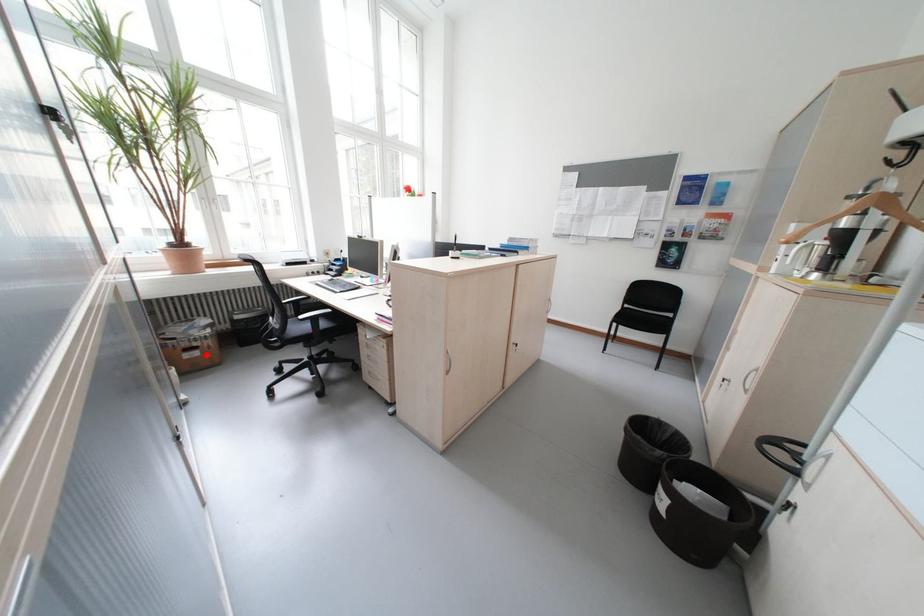
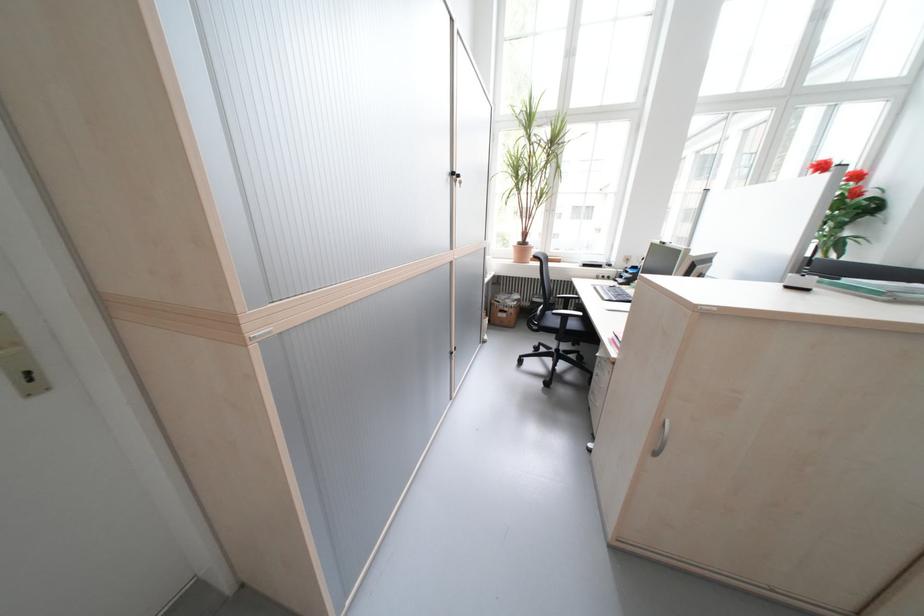
Question: I am providing you with two images of the same scene from different viewpoints. Image1 has a red point marked. In image2, the corresponding 3D location appears at what relative position? Reply with the corresponding letter.

Choices:
 (A) Closer
 (B) Farther

Answer: (A)